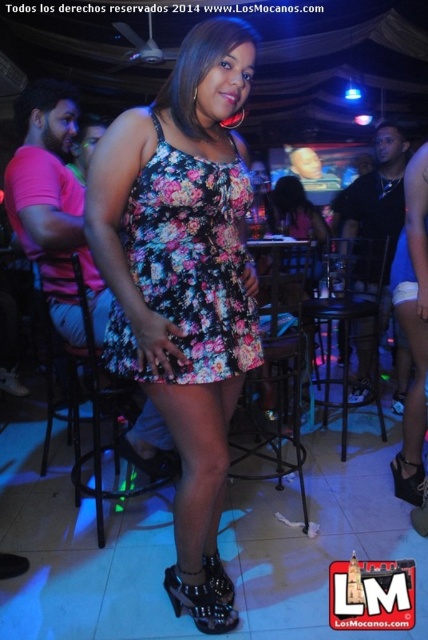
Consider the image. You are a photographer adjusting the lighting in the nightclub scene. The floral fabric dress at center is positioned at coordinates 0.414, 0.428. To ensure proper lighting, you need to place a spotlight directly above it. What are the coordinates where you should position the spotlight?

The spotlight should be placed directly above the floral fabric dress at center at coordinates (183, 264).

You are a photographer trying to capture the woman in the nightclub scene. You notice the floral fabric dress at center and the black patent leather sandal at lower right. Which object is positioned higher in the image?

The floral fabric dress at center is above the black patent leather sandal at lower right, so the floral fabric dress at center is positioned higher in the image.

You are standing in the nightclub and want to take a photo of the two points mentioned. Which point, point (213, 460) or point (207, 579), is closer to you?

Point (213, 460) is closer to the viewer than point (207, 579).